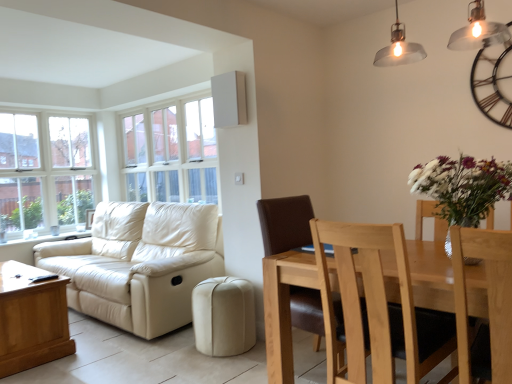
Question: From the image's perspective, is matte silver pendant light at upper right beneath light brown wood chair at lower right, arranged as the 2th chair when viewed from the back?

Choices:
 (A) no
 (B) yes

Answer: (A)

Question: Could you tell me if matte silver pendant light at upper right is turned towards light brown wood chair at lower right, acting as the 2th chair starting from the front?

Choices:
 (A) yes
 (B) no

Answer: (B)

Question: Is matte silver pendant light at upper right not within light brown wood chair at lower right, acting as the 2th chair starting from the front?

Choices:
 (A) no
 (B) yes

Answer: (B)

Question: Does matte silver pendant light at upper right come in front of light brown wood chair at lower right, acting as the 2th chair starting from the front?

Choices:
 (A) yes
 (B) no

Answer: (B)

Question: Does matte silver pendant light at upper right have a greater height compared to light brown wood chair at lower right, acting as the 2th chair starting from the front?

Choices:
 (A) yes
 (B) no

Answer: (B)

Question: From a real-world perspective, is white glass window at upper center, which appears as the second window when viewed from the left, above or below beige leather couch at left?

Choices:
 (A) above
 (B) below

Answer: (A)

Question: In terms of size, does white glass window at upper center, which appears as the second window when viewed from the left, appear bigger or smaller than beige leather couch at left?

Choices:
 (A) big
 (B) small

Answer: (B)

Question: Visually, is white glass window at upper center, placed as the first window when sorted from right to left, positioned to the left or to the right of beige leather couch at left?

Choices:
 (A) right
 (B) left

Answer: (A)

Question: In the image, is white glass window at upper center, placed as the first window when sorted from right to left, positioned in front of or behind beige leather couch at left?

Choices:
 (A) behind
 (B) front

Answer: (A)

Question: Relative to white glass window at upper center, placed as the first window when sorted from right to left, is brown leather chair at center, arranged as the third chair when viewed from the front, in front or behind?

Choices:
 (A) behind
 (B) front

Answer: (B)

Question: Looking at the image, does brown leather chair at center, placed as the first chair when sorted from back to front, seem bigger or smaller compared to white glass window at upper center, which appears as the second window when viewed from the left?

Choices:
 (A) big
 (B) small

Answer: (B)

Question: From the image's perspective, is brown leather chair at center, arranged as the third chair when viewed from the front, positioned above or below white glass window at upper center, which appears as the second window when viewed from the left?

Choices:
 (A) below
 (B) above

Answer: (A)

Question: Is point (293, 322) positioned closer to the camera than point (139, 170)?

Choices:
 (A) closer
 (B) farther

Answer: (A)

Question: Is beige leather ottoman at lower center wider or thinner than brown leather chair at center, arranged as the third chair when viewed from the front?

Choices:
 (A) wide
 (B) thin

Answer: (B)

Question: From a real-world perspective, is beige leather ottoman at lower center positioned above or below brown leather chair at center, placed as the first chair when sorted from back to front?

Choices:
 (A) above
 (B) below

Answer: (B)